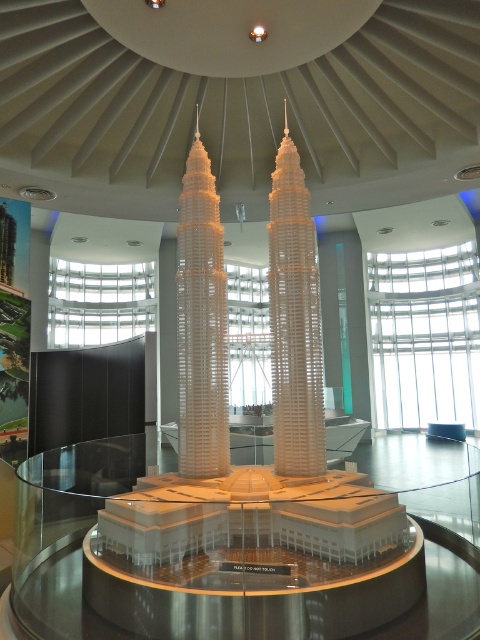
You are standing in the room where the Petronas Twin Towers model is displayed. You want to take a photo of the model from a position that is exactly 8.56 meters away from the camera. Is the point at coordinates point (315, 308) within this distance range?

The distance between point (315, 308) and the camera is exactly 8.56 meters, so yes, the point at coordinates point (315, 308) is exactly at the desired distance of 8.56 meters from the camera.

You are standing in the room and see the architectural model of the Petronas Twin Towers. The model has a point at coordinates (295, 321). What does this point correspond to?

The point at coordinates (295, 321) corresponds to the white plastic tower at center.